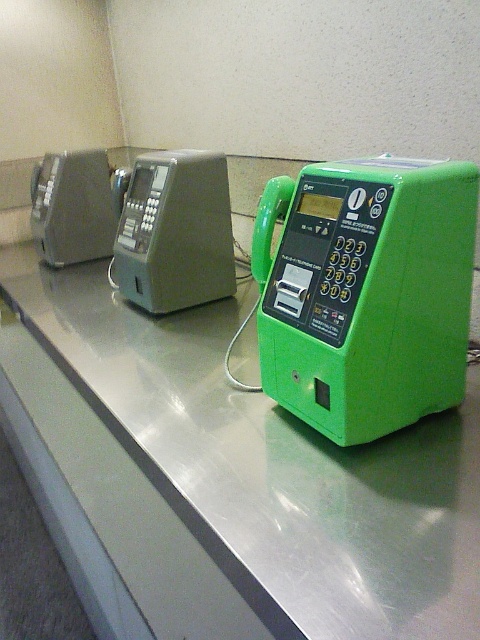
You are a maintenance worker checking the public payphones. You need to replace the coin slot on the green plastic phone at right and the green plastic payphone at center. Which one requires a wider replacement part?

The green plastic phone at right requires a wider replacement part because its width is larger than the green plastic payphone at center.

You are a maintenance worker checking the green plastic phone at right and the green plastic payphone at center. Which one is located lower in the image?

The green plastic phone at right is positioned under the green plastic payphone at center, so it is located lower in the image.

You are a traveler with a large backpack and need to use a payphone. You see the green plastic phone at right and the matte gray phone box at center. Which one do you think will give you more space to place your backpack next to it?

The green plastic phone at right has a larger size compared to the matte gray phone box at center, so it will provide more space to place your backpack next to it.